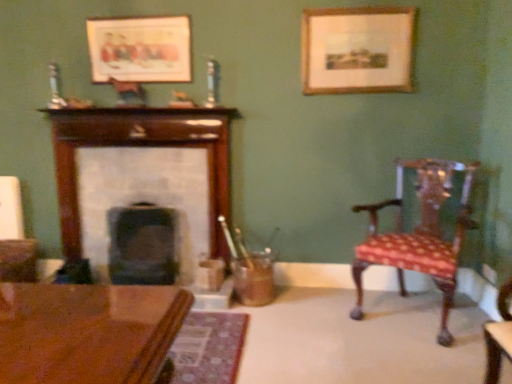
Question: Is wooden picture frame at upper right, which ranks as the 1th picture frame in right-to-left order, positioned beyond the bounds of wooden picture frame at upper center, placed as the second picture frame when sorted from right to left?

Choices:
 (A) no
 (B) yes

Answer: (B)

Question: Is wooden picture frame at upper right, the 2th picture frame when ordered from left to right, bigger than wooden picture frame at upper center, marked as the 1th picture frame in a left-to-right arrangement?

Choices:
 (A) yes
 (B) no

Answer: (A)

Question: Is wooden picture frame at upper right, which ranks as the 1th picture frame in right-to-left order, facing away from wooden picture frame at upper center, placed as the second picture frame when sorted from right to left?

Choices:
 (A) no
 (B) yes

Answer: (A)

Question: Is wooden picture frame at upper right, the 2th picture frame when ordered from left to right, facing towards wooden picture frame at upper center, marked as the 1th picture frame in a left-to-right arrangement?

Choices:
 (A) no
 (B) yes

Answer: (A)

Question: Does wooden picture frame at upper right, which ranks as the 1th picture frame in right-to-left order, come behind wooden picture frame at upper center, placed as the second picture frame when sorted from right to left?

Choices:
 (A) no
 (B) yes

Answer: (A)

Question: From the image's perspective, would you say wooden picture frame at upper right, the 2th picture frame when ordered from left to right, is shown under wooden picture frame at upper center, placed as the second picture frame when sorted from right to left?

Choices:
 (A) yes
 (B) no

Answer: (A)

Question: Considering the relative sizes of wooden fireplace at center, which is counted as the 2th fireplace, starting from the right, and polished wood chair at right in the image provided, is wooden fireplace at center, which is counted as the 2th fireplace, starting from the right, shorter than polished wood chair at right?

Choices:
 (A) yes
 (B) no

Answer: (B)

Question: From a real-world perspective, is wooden fireplace at center, placed as the 1th fireplace when sorted from left to right, physically above polished wood chair at right?

Choices:
 (A) no
 (B) yes

Answer: (B)

Question: Is wooden fireplace at center, placed as the 1th fireplace when sorted from left to right, outside of polished wood chair at right?

Choices:
 (A) yes
 (B) no

Answer: (A)

Question: Considering the relative sizes of wooden fireplace at center, which is counted as the 2th fireplace, starting from the right, and polished wood chair at right in the image provided, is wooden fireplace at center, which is counted as the 2th fireplace, starting from the right, bigger than polished wood chair at right?

Choices:
 (A) no
 (B) yes

Answer: (A)

Question: Are wooden fireplace at center, placed as the 1th fireplace when sorted from left to right, and polished wood chair at right far apart?

Choices:
 (A) no
 (B) yes

Answer: (B)

Question: Does wooden fireplace at center, which is counted as the 2th fireplace, starting from the right, have a greater width compared to polished wood chair at right?

Choices:
 (A) yes
 (B) no

Answer: (B)

Question: Considering the relative sizes of wooden picture frame at upper center, placed as the second picture frame when sorted from right to left, and polished wood chair at right in the image provided, is wooden picture frame at upper center, placed as the second picture frame when sorted from right to left, bigger than polished wood chair at right?

Choices:
 (A) no
 (B) yes

Answer: (A)